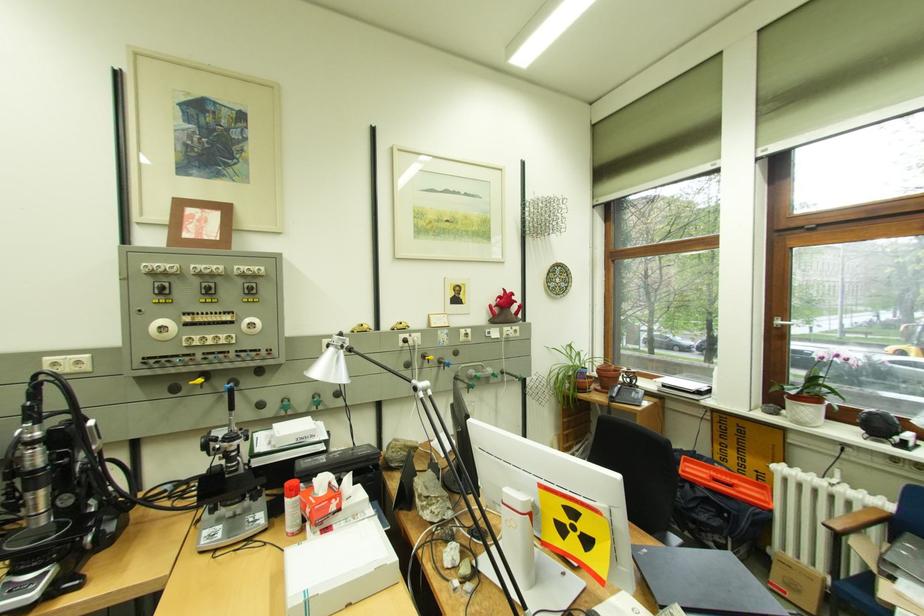
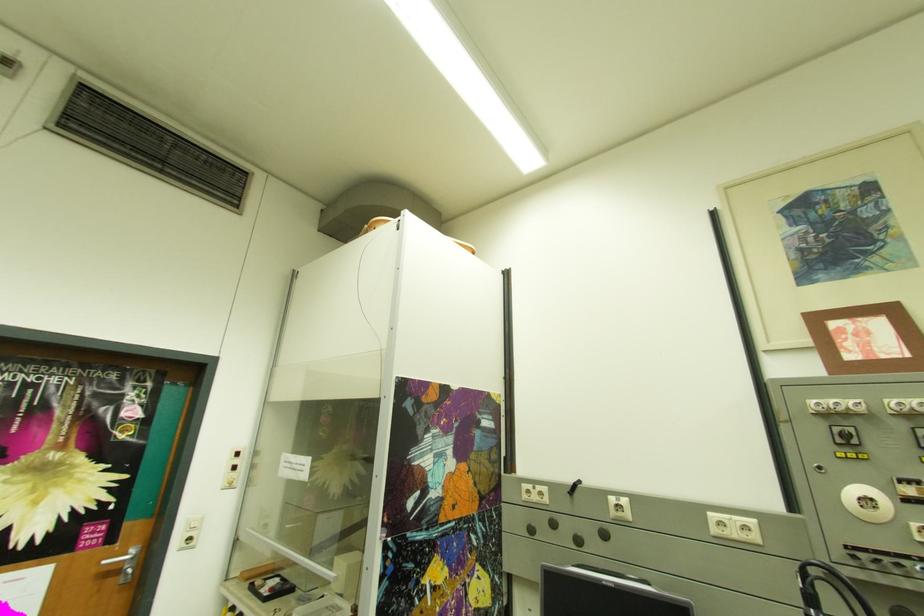
In the second image, find the point that corresponds to point (174, 330) in the first image.

(878, 501)